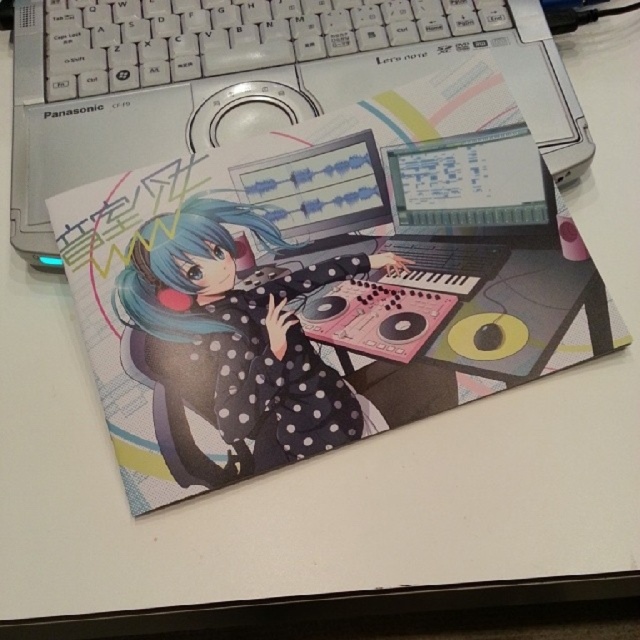
You are setting up a workspace and need to ensure that the polka dot fabric girl at center and the blue matte hair at center on your mousepad are visible from your desk chair. Since you can only adjust the mousepad height, which object should you raise to make sure both are visible?

The polka dot fabric girl at center is taller than the blue matte hair at center, so raising the mousepad would make both visible but since the girl is taller, you need to ensure the mousepad is raised enough so that the polka dot fabric girl at center doesn t block the view of the blue matte hair at center.

You are organizing your desk and want to place a new item between the white plastic keyboard at upper center and the blue matte hair at center. Can you fit it there?

→ The white plastic keyboard at upper center is positioned on the right side of blue matte hair at center, so there is space between them. You can fit an item there as long as it is smaller than the distance between them.

You are organizing a desk and need to place a new sticker. The sticker is exactly the same width as the blue matte hair at center. Can you place the sticker next to the polka dot fabric girl at center without overlapping?

The polka dot fabric girl at center is wider than the blue matte hair at center. Since the sticker matches the hair width, it can fit next to the girl without overlapping.